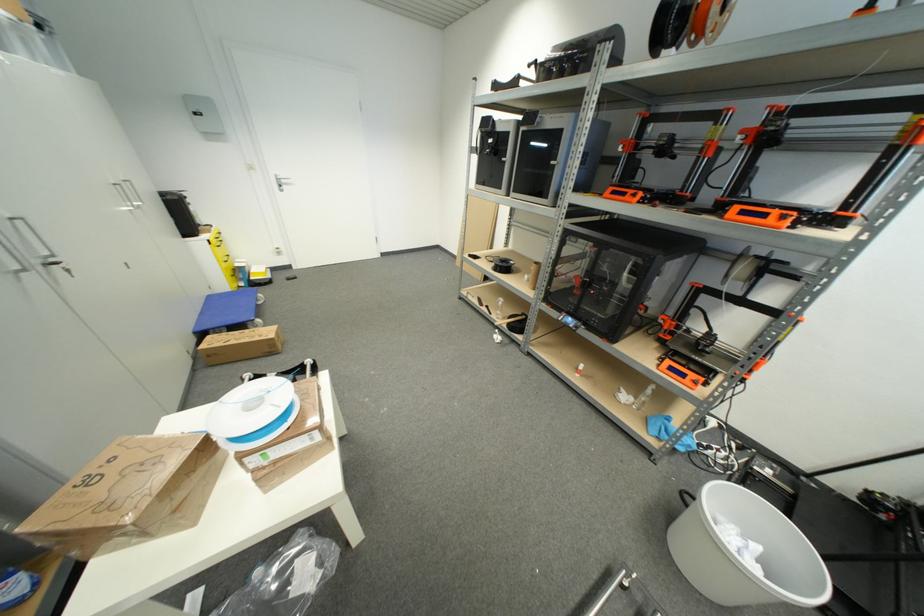
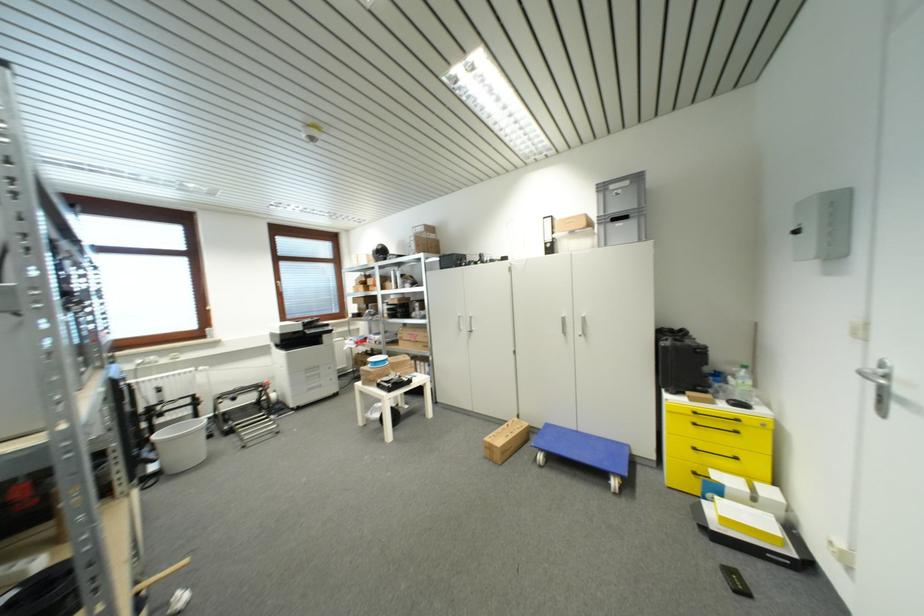
Where in the second image is the point corresponding to (199,334) from the first image?

(552, 427)